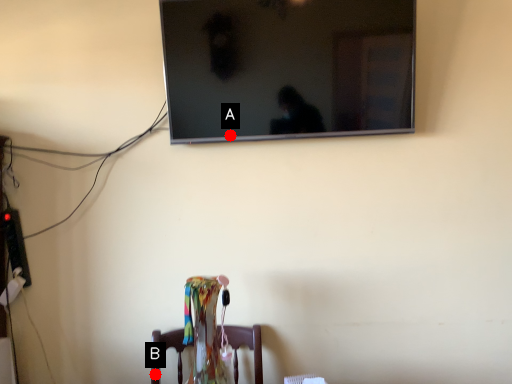
Question: Two points are circled on the image, labeled by A and B beside each circle. Which point is farther from the camera taking this photo?

Choices:
 (A) A is further
 (B) B is further

Answer: (B)